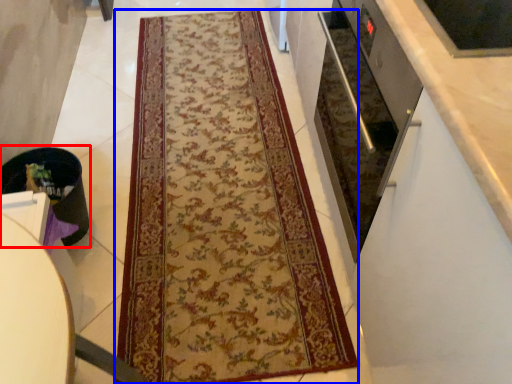
Question: Which point is further to the camera, appliance (highlighted by a red box) or mat (highlighted by a blue box)?

Choices:
 (A) appliance
 (B) mat

Answer: (A)